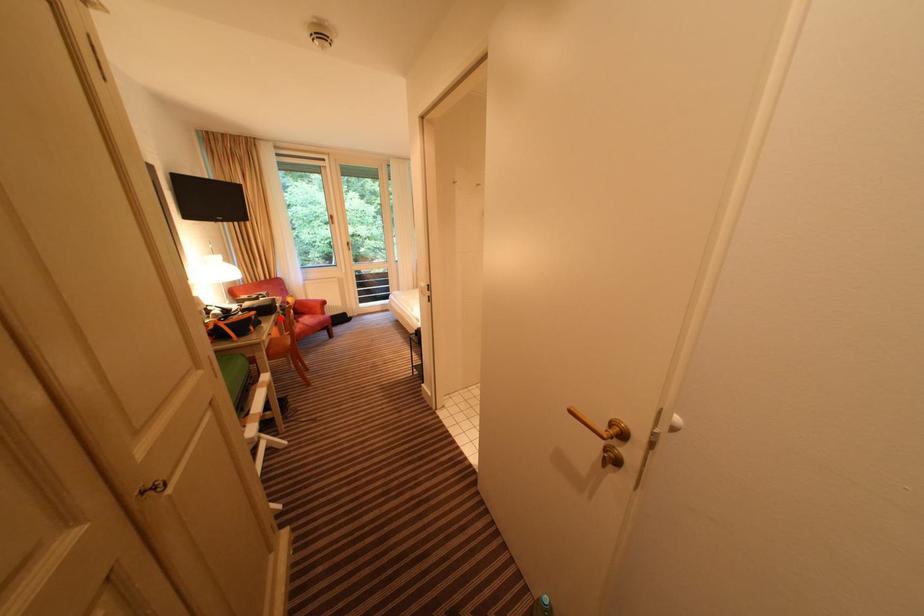
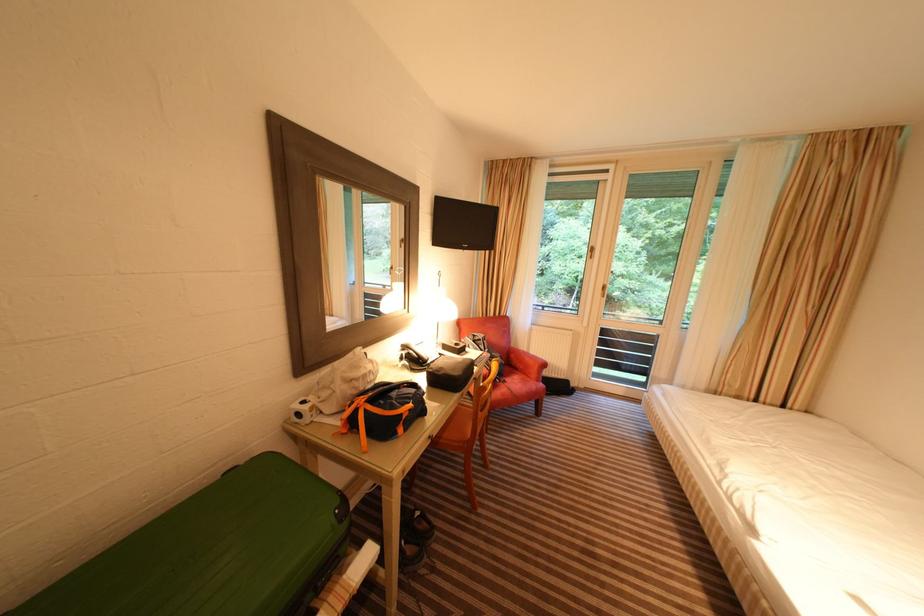
Locate, in the second image, the point that corresponds to the highlighted location in the first image.

(463, 399)